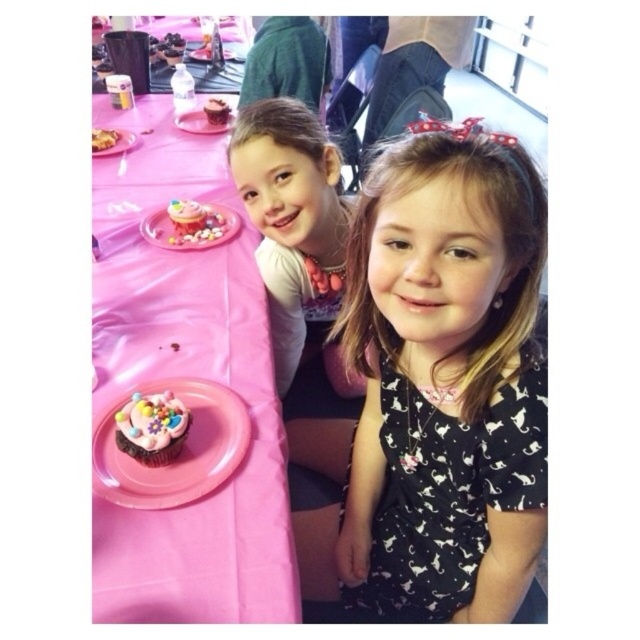
Does black printed dress at center appear on the right side of matte pink cupcake at center?

Correct, you'll find black printed dress at center to the right of matte pink cupcake at center.

Who is more forward, (392, 316) or (211, 109)?

Positioned in front is point (392, 316).

Who is more distant from viewer, (362, 355) or (220, 100)?

The point (220, 100) is more distant.

You are a GUI agent. You are given a task and a screenshot of the screen. Output one action in this format:
    pyautogui.click(x=<x>, y=<y>)
    Task: Click on the black printed dress at center
    The image size is (640, 640).
    Given the screenshot: What is the action you would take?
    pyautogui.click(x=445, y=380)

Can you confirm if pink paper plate at lower left is positioned to the left of pink paper plate at upper center?

No, pink paper plate at lower left is not to the left of pink paper plate at upper center.

Between point (104, 412) and point (198, 131), which one is positioned behind?

The point (198, 131) is more distant.

Which is behind, point (134, 429) or point (189, 116)?

The point (189, 116) is behind.

You are a GUI agent. You are given a task and a screenshot of the screen. Output one action in this format:
    pyautogui.click(x=<x>, y=<y>)
    Task: Click on the pink paper plate at lower left
    Image resolution: width=640 pixels, height=640 pixels.
    Given the screenshot: What is the action you would take?
    pyautogui.click(x=168, y=444)

Which is more to the right, chocolate frosted cupcake at center or pink paper plate at upper center?

chocolate frosted cupcake at center

Who is positioned more to the left, chocolate frosted cupcake at center or pink paper plate at upper center?

pink paper plate at upper center is more to the left.

Is point (157, 419) positioned before point (195, 118)?

That is True.

At what (x,y) coordinates should I click in order to perform the action: click on chocolate frosted cupcake at center. Please return your answer as a coordinate pair (x, y). Looking at the image, I should click on (150, 428).